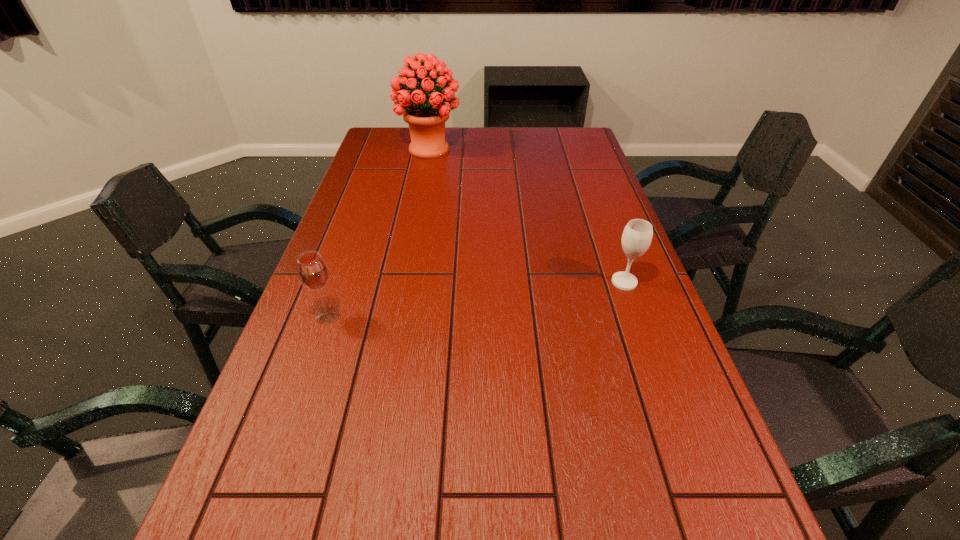
This screenshot has width=960, height=540. Identify the location of vacant space in between the rightmost object and the left wineglass. (476, 299).

The width and height of the screenshot is (960, 540). What are the coordinates of `empty location between the nearest object and the farthest object` in the screenshot? It's located at (378, 233).

Image resolution: width=960 pixels, height=540 pixels. I want to click on vacant area that lies between the nearer wineglass and the farthest object, so click(x=378, y=233).

Locate an element on the screen. free space between the second nearest object and the left wineglass is located at coordinates (476, 299).

Identify the location of object that stands as the second closest to the leftmost object. The image size is (960, 540). (426, 111).

Locate which object ranks second in proximity to the leftmost object. Please provide its 2D coordinates. Your answer should be formatted as a tuple, i.e. [(x, y)], where the tuple contains the x and y coordinates of a point satisfying the conditions above.

[(426, 111)]

The image size is (960, 540). Identify the location of vacant space that satisfies the following two spatial constraints: 1. on the back side of the nearest object; 2. on the right side of the second farthest object. (339, 282).